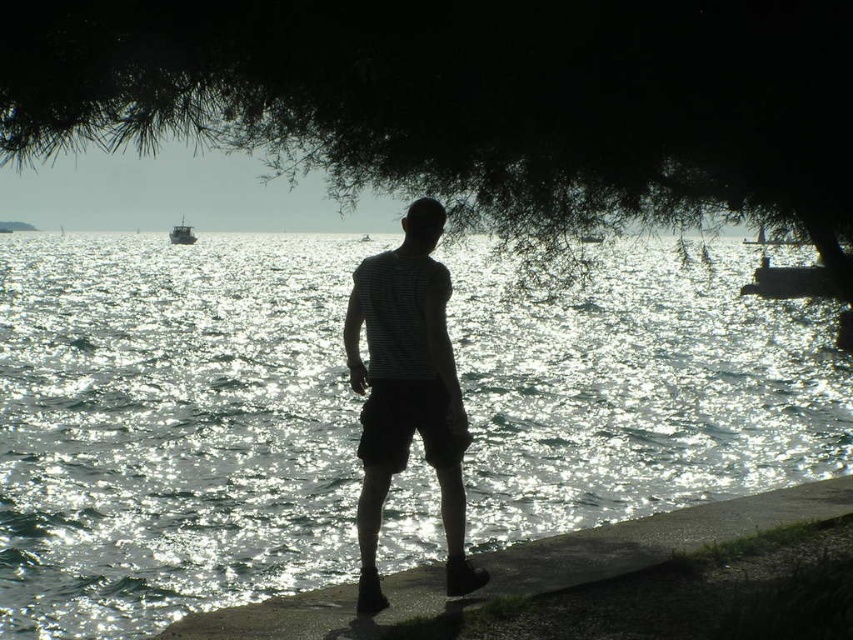
Can you confirm if concrete ledge at lower right is positioned below metallic silver boat at center?

Yes, concrete ledge at lower right is below metallic silver boat at center.

Looking at this image, does concrete ledge at lower right come in front of metallic silver boat at center?

Yes.

Is point (347, 589) more distant than point (186, 228)?

No, (347, 589) is in front of (186, 228).

Find the location of `concrete ledge at lower right`. concrete ledge at lower right is located at coordinates pyautogui.click(x=654, y=538).

Who is more distant from viewer, (202, 493) or (778, 512)?

The point (202, 493) is behind.

Is sparkling silver water at center wider than concrete ledge at lower right?

Yes.

Describe the element at coordinates (171, 426) in the screenshot. Image resolution: width=853 pixels, height=640 pixels. I see `sparkling silver water at center` at that location.

Where is `sparkling silver water at center`? sparkling silver water at center is located at coordinates (171, 426).

Which is more to the left, dark green leafy tree at upper center or metallic silver boat at center?

metallic silver boat at center is more to the left.

Does dark green leafy tree at upper center have a larger size compared to metallic silver boat at center?

Indeed, dark green leafy tree at upper center has a larger size compared to metallic silver boat at center.

Is point (622, 83) farther from viewer compared to point (180, 230)?

No, (622, 83) is closer to viewer.

Where is `dark green leafy tree at upper center`? The height and width of the screenshot is (640, 853). dark green leafy tree at upper center is located at coordinates (469, 100).